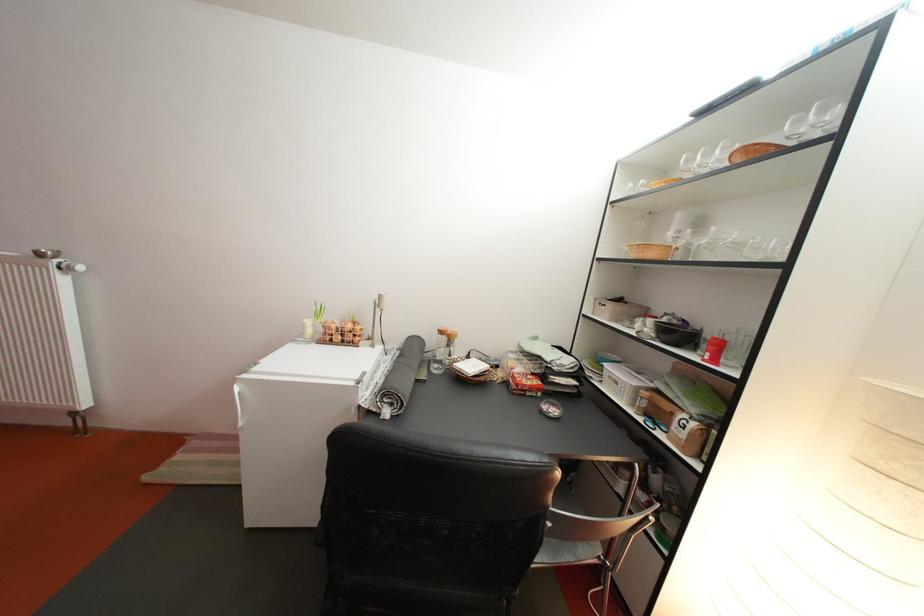
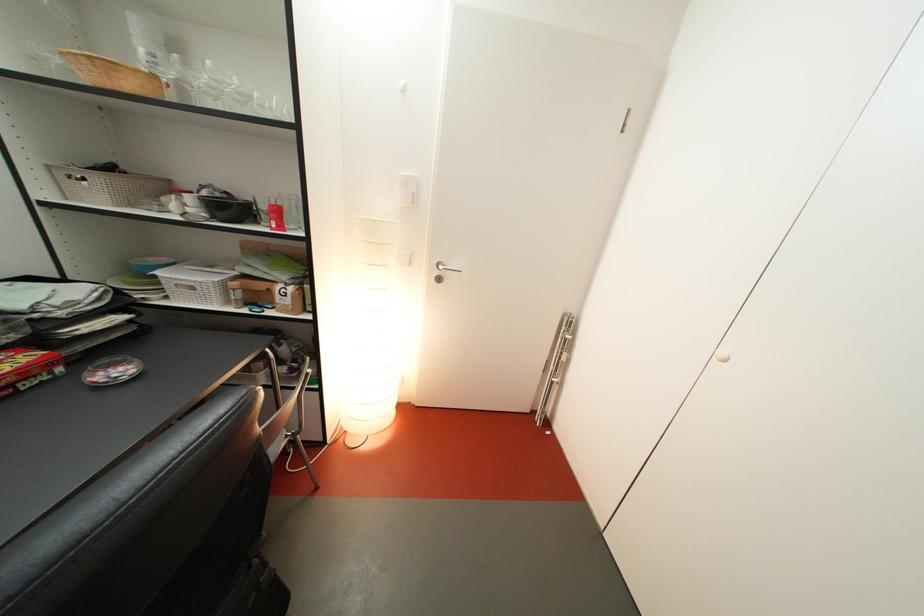
Find the pixel in the second image that matches point (654, 410) in the first image.

(249, 301)